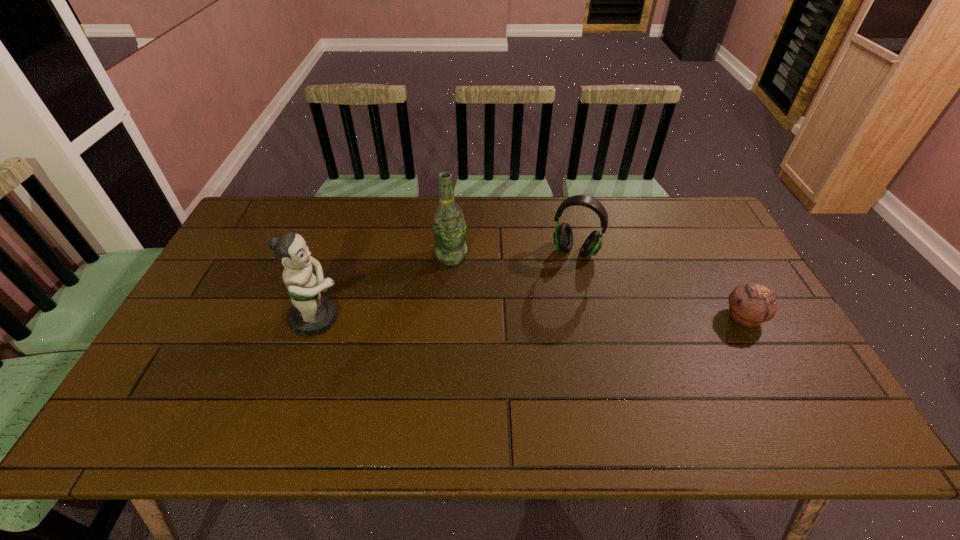
This screenshot has height=540, width=960. I want to click on free spot located on the ear cups of the second object from right to left, so click(x=561, y=283).

You are a GUI agent. You are given a task and a screenshot of the screen. Output one action in this format:
    pyautogui.click(x=<x>, y=<y>)
    Task: Click on the vacant position located on the surface of the second object from left to right
    This screenshot has width=960, height=540.
    Given the screenshot: What is the action you would take?
    pyautogui.click(x=476, y=329)

Identify the location of vacant region located 0.250m on the surface of the second object from left to right. (476, 329).

At what (x,y) coordinates should I click in order to perform the action: click on free spot located 0.390m on the surface of the second object from left to right. Please return your answer as a coordinate pair (x, y). Image resolution: width=960 pixels, height=540 pixels. Looking at the image, I should click on (492, 373).

Identify the location of object present at the far edge. (563, 237).

I want to click on object located at the right edge, so click(750, 305).

Image resolution: width=960 pixels, height=540 pixels. Identify the location of vacant area at the far edge. (324, 209).

Locate an element on the screen. The image size is (960, 540). free space at the near edge of the desktop is located at coordinates (497, 378).

Find the location of a particular element. This screenshot has height=540, width=960. free space at the right edge of the desktop is located at coordinates (780, 356).

At what (x,y) coordinates should I click in order to perform the action: click on vacant area at the far right corner of the desktop. Please return your answer as a coordinate pair (x, y). Image resolution: width=960 pixels, height=540 pixels. Looking at the image, I should click on (704, 220).